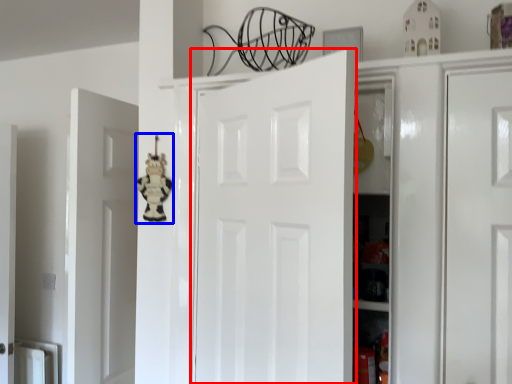
Question: Which of the following is the farthest to the observer, door (highlighted by a red box) or toy (highlighted by a blue box)?

Choices:
 (A) door
 (B) toy

Answer: (B)